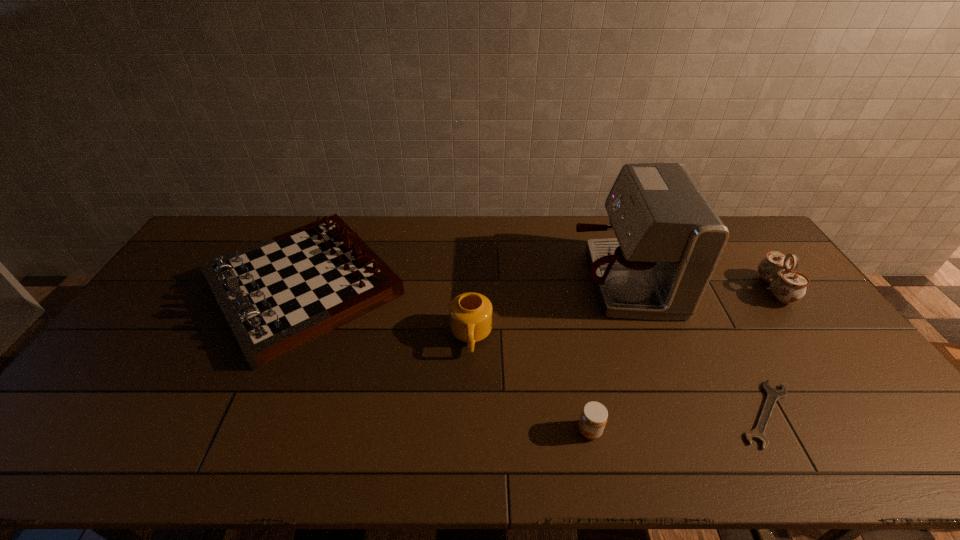
Choose which object is the fourth nearest neighbor to the leftmost object. Please provide its 2D coordinates. Your answer should be formatted as a tuple, i.e. [(x, y)], where the tuple contains the x and y coordinates of a point satisfying the conditions above.

[(773, 395)]

Find the location of a particular element. This screenshot has height=540, width=960. free point that satisfies the following two spatial constraints: 1. on the front side of the leftmost object; 2. on the left side of the shortest object is located at coordinates (248, 414).

You are a GUI agent. You are given a task and a screenshot of the screen. Output one action in this format:
    pyautogui.click(x=<x>, y=<y>)
    Task: Click on the free space that satisfies the following two spatial constraints: 1. on the back side of the wrench; 2. on the front of the tallest object near the spout
    
    Given the screenshot: What is the action you would take?
    pyautogui.click(x=694, y=280)